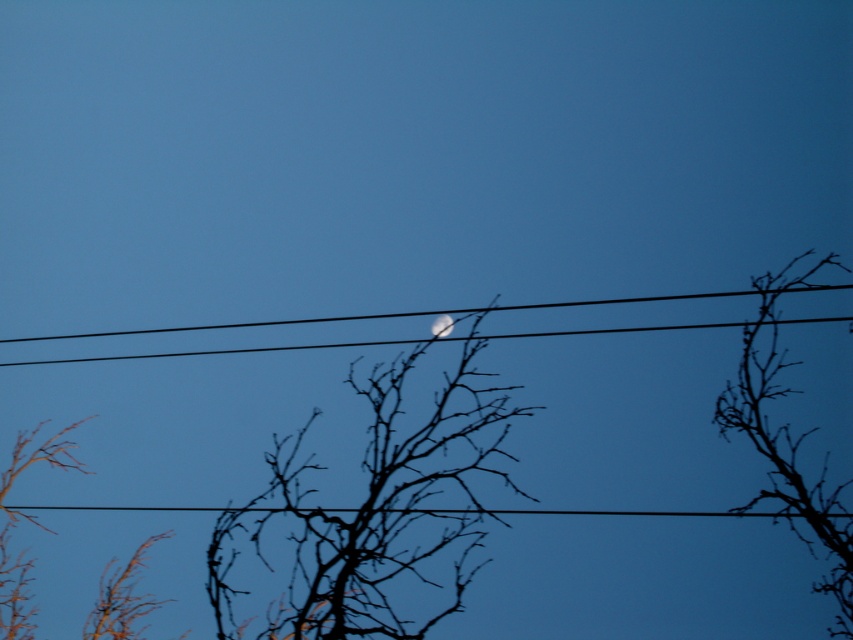
Question: Based on their relative distances, which object is farther from the brown/drytree at lower left?

Choices:
 (A) black wire at center
 (B) brown/drytree at right

Answer: (B)

Question: Can you confirm if brown/drytree at right is positioned to the left of black wire at center?

Choices:
 (A) no
 (B) yes

Answer: (A)

Question: Does brown/drytree at right appear over black wire at center?

Choices:
 (A) yes
 (B) no

Answer: (B)

Question: Which point appears farthest from the camera in this image?

Choices:
 (A) (22, 627)
 (B) (410, 369)
 (C) (596, 300)
 (D) (804, 531)

Answer: (C)

Question: Among these points, which one is nearest to the camera?

Choices:
 (A) (743, 413)
 (B) (445, 528)

Answer: (B)

Question: Does silhouette bare branches at center appear over black wire at center?

Choices:
 (A) no
 (B) yes

Answer: (A)